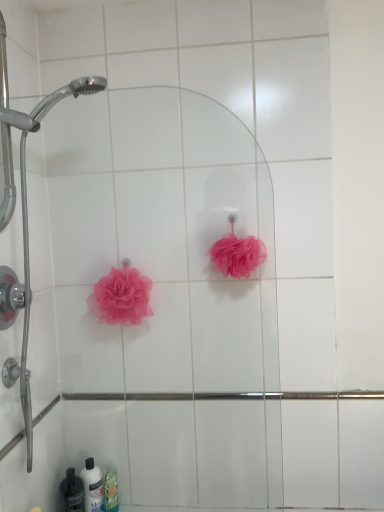
Question: From the image's perspective, is translucent plastic bottle at lower left, the 1th toiletry in the left-to-right sequence, located above or below pink mesh sponge at lower left, marked as the 1th rose in a left-to-right arrangement?

Choices:
 (A) above
 (B) below

Answer: (B)

Question: Based on their sizes in the image, would you say translucent plastic bottle at lower left, the 1th toiletry in the left-to-right sequence, is bigger or smaller than pink mesh sponge at lower left, which appears as the 2th rose when viewed from the right?

Choices:
 (A) big
 (B) small

Answer: (B)

Question: Which of these objects is positioned farthest from the pink mesh sponge at lower left, marked as the 1th rose in a left-to-right arrangement?

Choices:
 (A) translucent plastic bottle at lower left, acting as the third toiletry starting from the right
 (B) pink mesh sponge at center, the 2th rose viewed from the left
 (C) white glossy bottle at lower left, which is the 2th toiletry in left-to-right order
 (D) pink mesh sponge at upper center
 (E) green matte soap at lower left, marked as the 1th toiletry in a right-to-left arrangement

Answer: (A)

Question: Which is nearer to the green matte soap at lower left, the third toiletry in the left-to-right sequence?

Choices:
 (A) pink mesh sponge at center, which is counted as the first rose, starting from the right
 (B) pink mesh sponge at lower left, marked as the 1th rose in a left-to-right arrangement
 (C) white glossy bottle at lower left, which is the second toiletry in right-to-left order
 (D) translucent plastic bottle at lower left, the 1th toiletry in the left-to-right sequence
 (E) pink mesh sponge at upper center

Answer: (C)